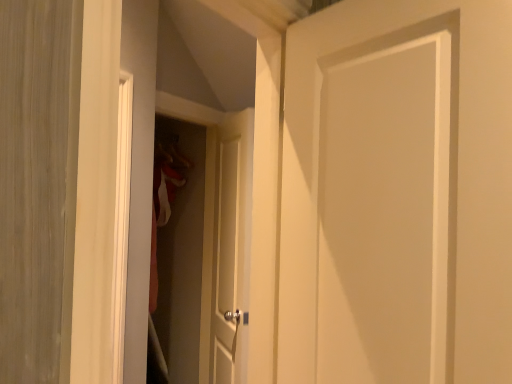
Question: From a real-world perspective, is matte white screen door at center located beneath white matte door at center, the 1th door in the back-to-front sequence?

Choices:
 (A) yes
 (B) no

Answer: (B)

Question: Does matte white screen door at center have a greater height compared to white matte door at center, the 1th door in the back-to-front sequence?

Choices:
 (A) no
 (B) yes

Answer: (B)

Question: Are matte white screen door at center and white matte door at center, the 1th door in the back-to-front sequence, beside each other?

Choices:
 (A) yes
 (B) no

Answer: (B)

Question: Can you confirm if matte white screen door at center is wider than white matte door at center, the 1th door in the back-to-front sequence?

Choices:
 (A) yes
 (B) no

Answer: (A)

Question: From the image's perspective, does matte white screen door at center appear lower than white matte door at center, the second door positioned from the right?

Choices:
 (A) no
 (B) yes

Answer: (A)

Question: Is matte white screen door at center taller or shorter than white matte door at center, the 1th door in the back-to-front sequence?

Choices:
 (A) tall
 (B) short

Answer: (A)

Question: From the image's perspective, is matte white screen door at center located above or below white matte door at center, the 2th door positioned from the front?

Choices:
 (A) above
 (B) below

Answer: (A)

Question: Is matte white screen door at center bigger or smaller than white matte door at center, the 2th door positioned from the front?

Choices:
 (A) big
 (B) small

Answer: (A)

Question: In terms of width, does matte white screen door at center look wider or thinner when compared to white matte door at center, the 1th door in the left-to-right sequence?

Choices:
 (A) thin
 (B) wide

Answer: (B)

Question: Considering the positions of point (224, 183) and point (201, 144), is point (224, 183) closer or farther from the camera than point (201, 144)?

Choices:
 (A) closer
 (B) farther

Answer: (A)

Question: From the image's perspective, is white matte door at center, the 1th door in the left-to-right sequence, located above or below matte white screen door at center?

Choices:
 (A) below
 (B) above

Answer: (A)

Question: In the image, is white matte door at center, the 1th door in the left-to-right sequence, on the left side or the right side of matte white screen door at center?

Choices:
 (A) right
 (B) left

Answer: (A)

Question: Is white matte door at center, the 1th door in the back-to-front sequence, bigger or smaller than matte white screen door at center?

Choices:
 (A) small
 (B) big

Answer: (A)

Question: Considering the positions of white matte door at center, the 1th door when ordered from front to back, and matte white screen door at center in the image, is white matte door at center, the 1th door when ordered from front to back, bigger or smaller than matte white screen door at center?

Choices:
 (A) small
 (B) big

Answer: (A)

Question: Choose the correct answer: Is white matte door at center, acting as the 1th door starting from the right, inside matte white screen door at center or outside it?

Choices:
 (A) inside
 (B) outside

Answer: (B)